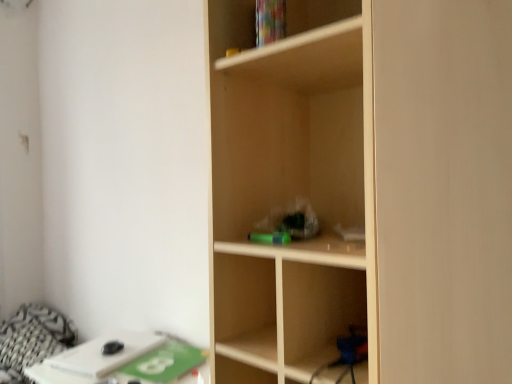
Question: From a real-world perspective, is patterned fabric bedding at lower left above or below white matte table at lower left?

Choices:
 (A) below
 (B) above

Answer: (A)

Question: Is patterned fabric bedding at lower left taller or shorter than white matte table at lower left?

Choices:
 (A) tall
 (B) short

Answer: (A)

Question: Which of these objects is positioned farthest from the light wood shelf at center?

Choices:
 (A) patterned fabric bedding at lower left
 (B) white matte table at lower left
 (C) green matte paperback book at lower left

Answer: (A)

Question: Estimate the real-world distances between objects in this image. Which object is farther from the green matte paperback book at lower left?

Choices:
 (A) light wood shelf at center
 (B) white matte table at lower left
 (C) patterned fabric bedding at lower left

Answer: (A)